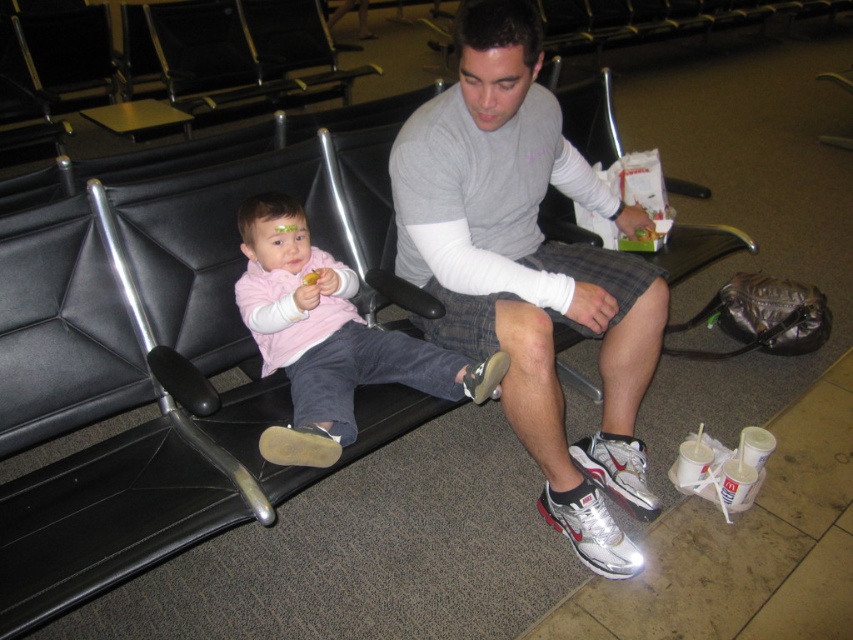
The width and height of the screenshot is (853, 640). Describe the element at coordinates (529, 269) in the screenshot. I see `gray cotton shirt at center` at that location.

Can you confirm if gray cotton shirt at center is positioned above pink fleece sweater at center?

Correct, gray cotton shirt at center is located above pink fleece sweater at center.

Which is behind, point (582, 246) or point (473, 387)?

The point (582, 246) is behind.

Find the location of a particular element. gray cotton shirt at center is located at coordinates (529, 269).